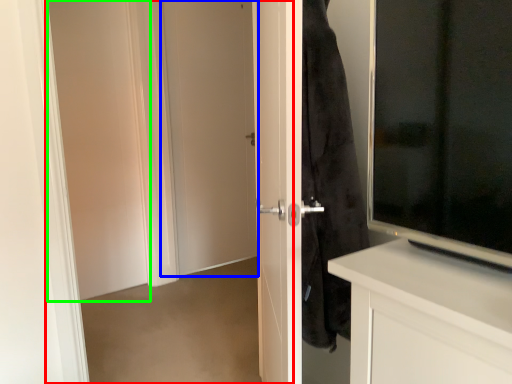
Question: Based on their relative distances, which object is nearer to screen door (highlighted by a red box)? Choose from door (highlighted by a blue box) and screen door (highlighted by a green box).

Choices:
 (A) door
 (B) screen door

Answer: (A)